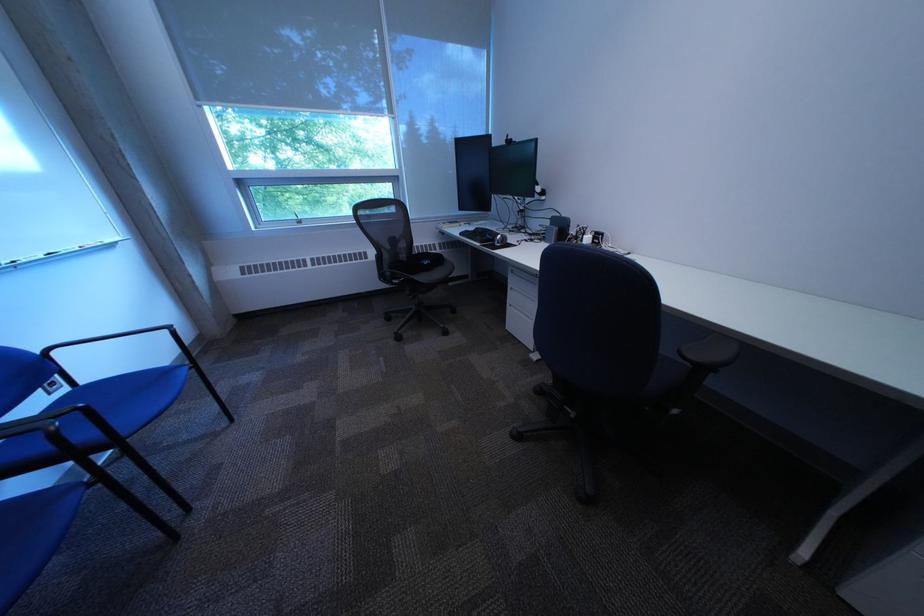
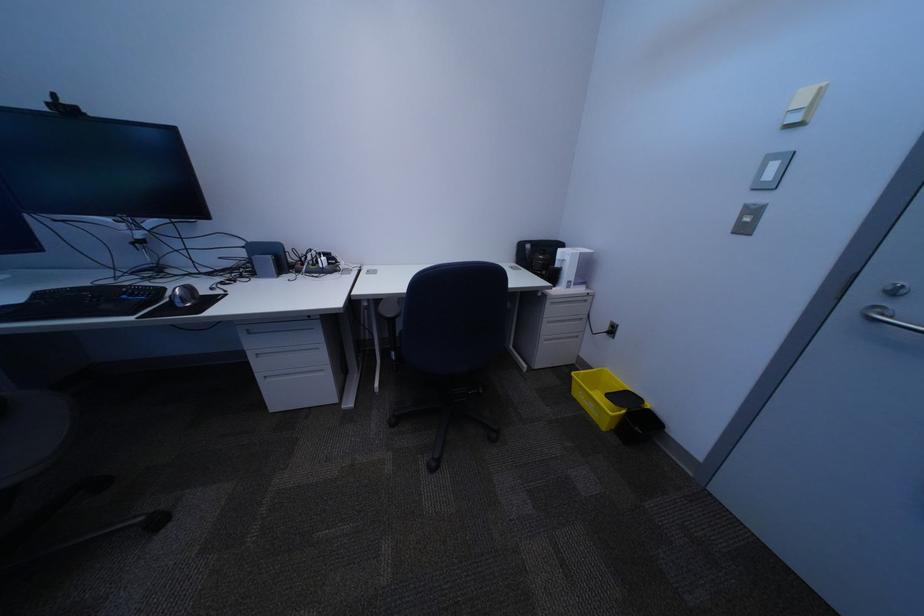
How did the camera likely rotate?

The rotation direction of the camera is right-down.